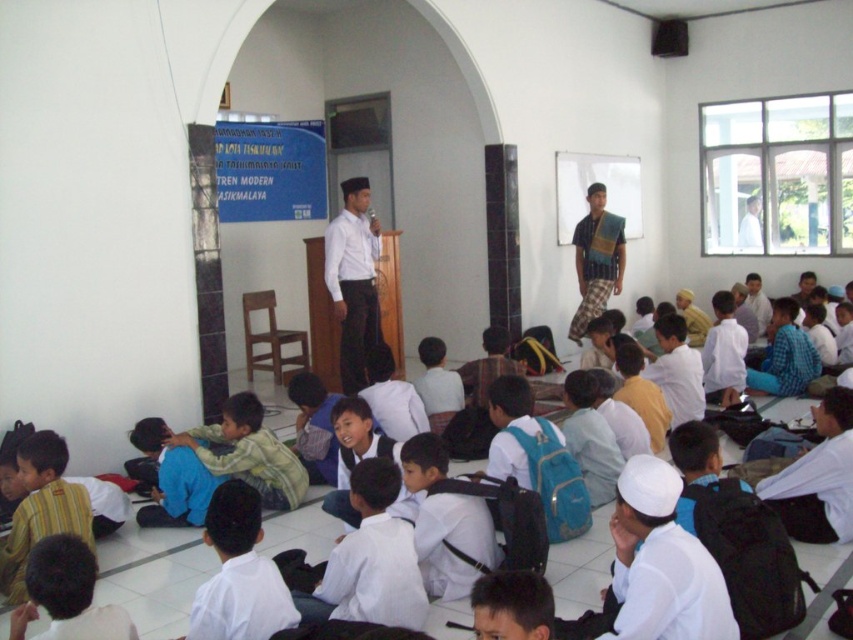
Who is taller, white uniform shirt at lower right or blue plaid shirt at center?

blue plaid shirt at center is taller.

Does point (828, 472) lie behind point (590, 252)?

No, (828, 472) is in front of (590, 252).

Where is `white uniform shirt at lower right`? The height and width of the screenshot is (640, 853). white uniform shirt at lower right is located at coordinates (817, 477).

Can you confirm if white uniform shirt at lower right is shorter than white matte shirt at center?

Yes, white uniform shirt at lower right is shorter than white matte shirt at center.

Who is higher up, white uniform shirt at lower right or white matte shirt at center?

white matte shirt at center is above.

You are a GUI agent. You are given a task and a screenshot of the screen. Output one action in this format:
    pyautogui.click(x=<x>, y=<y>)
    Task: Click on the white uniform shirt at lower right
    The image size is (853, 640).
    Given the screenshot: What is the action you would take?
    pyautogui.click(x=817, y=477)

What are the coordinates of `white uniform shirt at lower right` in the screenshot? It's located at (817, 477).

Is point (648, 634) positioned after point (840, 508)?

No, it is in front of (840, 508).

Is point (683, 547) farther from viewer compared to point (844, 531)?

No, it is in front of (844, 531).

At what (x,y) coordinates should I click in order to perform the action: click on white matte backpack at lower center. Please return your answer as a coordinate pair (x, y). Image resolution: width=853 pixels, height=640 pixels. Looking at the image, I should click on (660, 563).